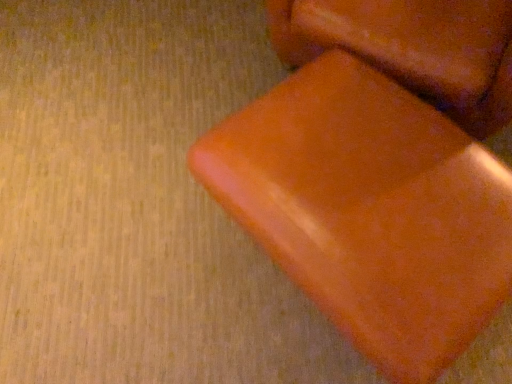
Question: Considering the relative sizes of orange matte block at center and orange matte bean bag chair at center in the image provided, is orange matte block at center taller than orange matte bean bag chair at center?

Choices:
 (A) yes
 (B) no

Answer: (A)

Question: Can you confirm if orange matte block at center is shorter than orange matte bean bag chair at center?

Choices:
 (A) no
 (B) yes

Answer: (A)

Question: Is orange matte block at center facing away from orange matte bean bag chair at center?

Choices:
 (A) no
 (B) yes

Answer: (A)

Question: From a real-world perspective, is orange matte block at center physically above orange matte bean bag chair at center?

Choices:
 (A) no
 (B) yes

Answer: (B)

Question: Does orange matte block at center have a smaller size compared to orange matte bean bag chair at center?

Choices:
 (A) no
 (B) yes

Answer: (A)

Question: Is orange matte block at center positioned beyond the bounds of orange matte bean bag chair at center?

Choices:
 (A) yes
 (B) no

Answer: (A)

Question: Is orange matte bean bag chair at center completely or partially outside of orange matte block at center?

Choices:
 (A) yes
 (B) no

Answer: (A)

Question: Is orange matte bean bag chair at center not close to orange matte block at center?

Choices:
 (A) no
 (B) yes

Answer: (A)

Question: Does orange matte bean bag chair at center have a lesser width compared to orange matte block at center?

Choices:
 (A) no
 (B) yes

Answer: (B)

Question: From the image's perspective, is orange matte bean bag chair at center located beneath orange matte block at center?

Choices:
 (A) no
 (B) yes

Answer: (B)

Question: Is orange matte bean bag chair at center shorter than orange matte block at center?

Choices:
 (A) no
 (B) yes

Answer: (B)

Question: Considering the relative positions of orange matte bean bag chair at center and orange matte block at center in the image provided, is orange matte bean bag chair at center to the right of orange matte block at center from the viewer's perspective?

Choices:
 (A) yes
 (B) no

Answer: (B)

Question: From a real-world perspective, is orange matte block at center above or below orange matte bean bag chair at center?

Choices:
 (A) above
 (B) below

Answer: (A)